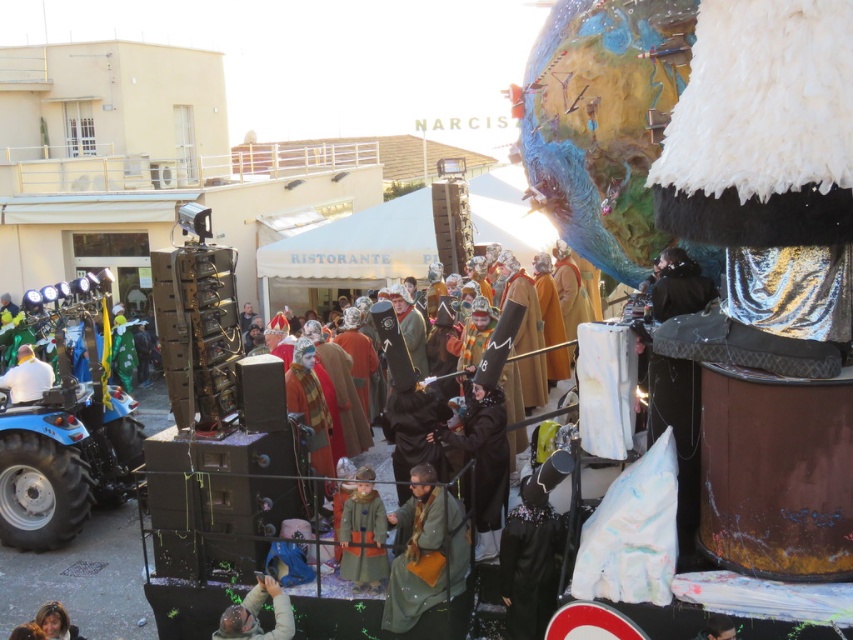
The height and width of the screenshot is (640, 853). What do you see at coordinates (257, 612) in the screenshot? I see `matte black helmet at lower center` at bounding box center [257, 612].

This screenshot has height=640, width=853. Describe the element at coordinates (257, 612) in the screenshot. I see `matte black helmet at lower center` at that location.

I want to click on matte black helmet at lower center, so click(257, 612).

Which of these two, green matte coat at center or smooth brown hair at lower left, stands shorter?

Standing shorter between the two is smooth brown hair at lower left.

Which is behind, point (421, 515) or point (39, 611)?

Positioned behind is point (421, 515).

I want to click on green matte coat at center, so click(x=427, y=564).

Does green matte coat at center have a lesser width compared to matte black helmet at lower center?

Incorrect, green matte coat at center's width is not less than matte black helmet at lower center's.

Is green matte coat at center smaller than matte black helmet at lower center?

Actually, green matte coat at center might be larger than matte black helmet at lower center.

What do you see at coordinates (427, 564) in the screenshot? This screenshot has height=640, width=853. I see `green matte coat at center` at bounding box center [427, 564].

Identify the location of green matte coat at center. Image resolution: width=853 pixels, height=640 pixels. (427, 564).